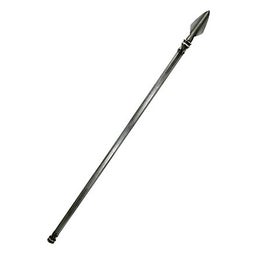
Where is `wooden handle`? The image size is (256, 256). wooden handle is located at coordinates (75, 205).